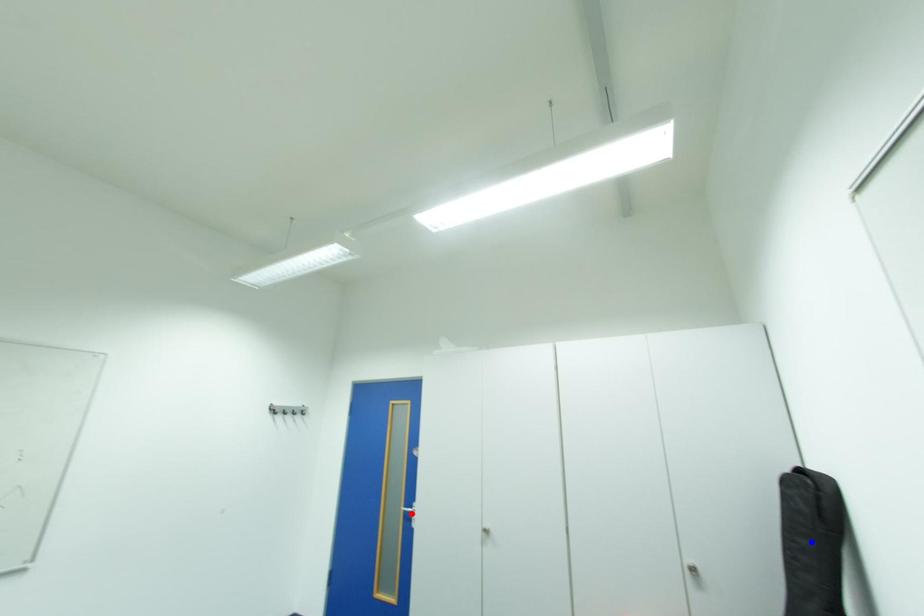
Question: Two points are marked on the image. Which point is closer to the camera?

Choices:
 (A) Blue point is closer.
 (B) Red point is closer.

Answer: (A)